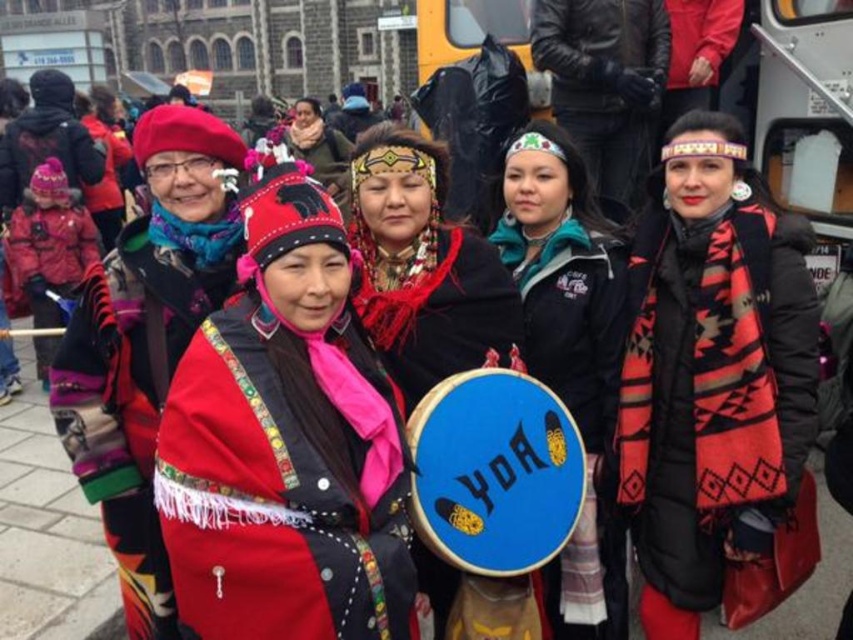
You are a photographer trying to capture a wide shot of the matte black coat at center and the matte black beret at upper left. Given that your camera can only focus on objects wider than 20 cm, will both items be in focus?

The matte black coat at center is wider than the matte black beret at upper left. Since the coat is wider than 20 cm, it will be in focus. However, the beret might be narrower than 20 cm and thus may not be in focus. Check the actual width of the beret to confirm.

You are a photographer trying to capture the cultural event. You notice two items at the center of your viewfinder, the velvet red shawl at center and the red and black woven scarf at center. Which one is positioned lower in the frame?

The velvet red shawl at center is positioned lower in the frame because it is below the red and black woven scarf at center.

You are standing at the origin of the coordinate system in the image. Which of the two points, point (276, 228) or point (152, 150), is closer to you?

Point (152, 150) is closer to you because it has a smaller y coordinate than point (276, 228), which means it is in front of the other point.